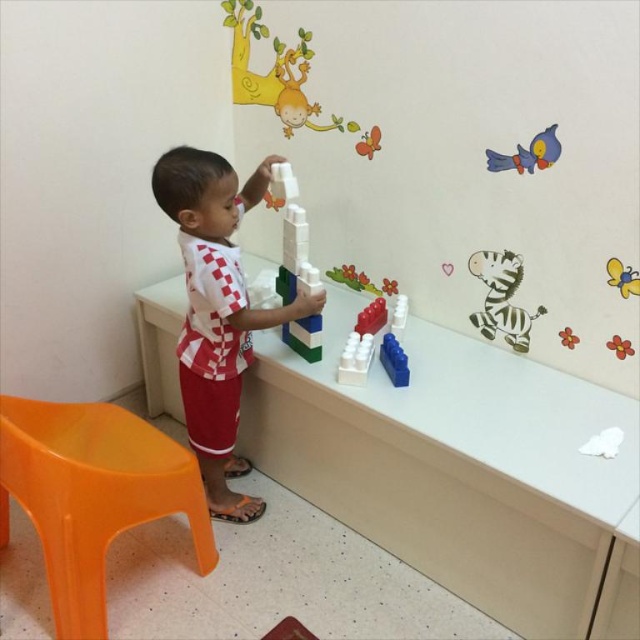
Does blue matte bird at upper right have a larger size compared to translucent plastic toy at center?

Incorrect, blue matte bird at upper right is not larger than translucent plastic toy at center.

Can you confirm if blue matte bird at upper right is positioned above translucent plastic toy at center?

Indeed, blue matte bird at upper right is positioned over translucent plastic toy at center.

Is point (540, 156) farther from camera compared to point (372, 285)?

No, it is in front of (372, 285).

This screenshot has height=640, width=640. I want to click on blue matte bird at upper right, so click(528, 154).

Consider the image. Is white plastic blocks at center positioned at the back of blue matte bird at upper right?

Yes, it is behind blue matte bird at upper right.

Who is lower down, white plastic blocks at center or blue matte bird at upper right?

white plastic blocks at center is below.

From the picture: Measure the distance between white plastic blocks at center and camera.

The distance of white plastic blocks at center from camera is 5.52 feet.

You are a GUI agent. You are given a task and a screenshot of the screen. Output one action in this format:
    pyautogui.click(x=<x>, y=<y>)
    Task: Click on the white plastic blocks at center
    
    Given the screenshot: What is the action you would take?
    click(x=291, y=236)

Is white matte zebra at upper right to the left of blue plastic blocks at lower right from the viewer's perspective?

In fact, white matte zebra at upper right is to the right of blue plastic blocks at lower right.

Does point (499, 294) come behind point (396, 358)?

That is True.

Between point (513, 280) and point (387, 352), which one is positioned behind?

The point (513, 280) is more distant.

Identify the location of white matte zebra at upper right. (500, 298).